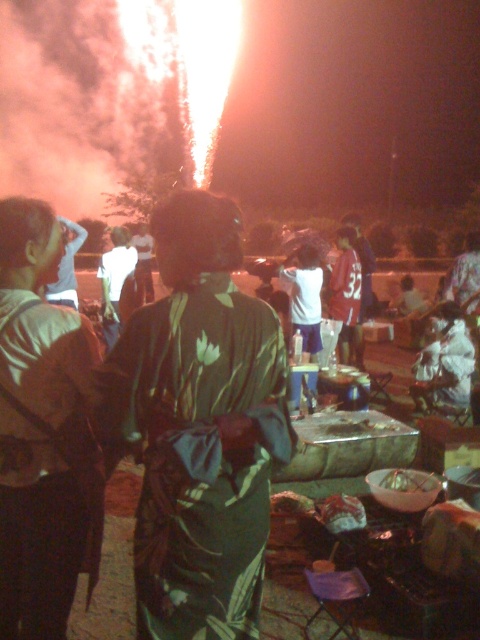
Between point (299, 248) and point (415, 488), which one is positioned in front?

Point (415, 488) is more forward.

Locate an element on the screen. white cotton shirt at center is located at coordinates (304, 296).

Between point (320, 308) and point (424, 486), which one is positioned in front?

Positioned in front is point (424, 486).

The height and width of the screenshot is (640, 480). In order to click on white cotton shirt at center in this screenshot , I will do `click(304, 296)`.

Who is higher up, green fabric dress at center or matte green dress at center?

green fabric dress at center

Does green fabric dress at center have a smaller size compared to matte green dress at center?

Indeed, green fabric dress at center has a smaller size compared to matte green dress at center.

Which is in front, point (181, 349) or point (61, 589)?

Point (181, 349)

The width and height of the screenshot is (480, 640). What are the coordinates of `green fabric dress at center` in the screenshot? It's located at (199, 428).

Who is more forward, (190, 356) or (113, 243)?

Point (190, 356)

Does point (176, 328) come farther from viewer compared to point (120, 326)?

No, it is in front of (120, 326).

Who is more forward, (204, 416) or (120, 241)?

Point (204, 416)

Locate an element on the screen. The height and width of the screenshot is (640, 480). green fabric dress at center is located at coordinates (199, 428).